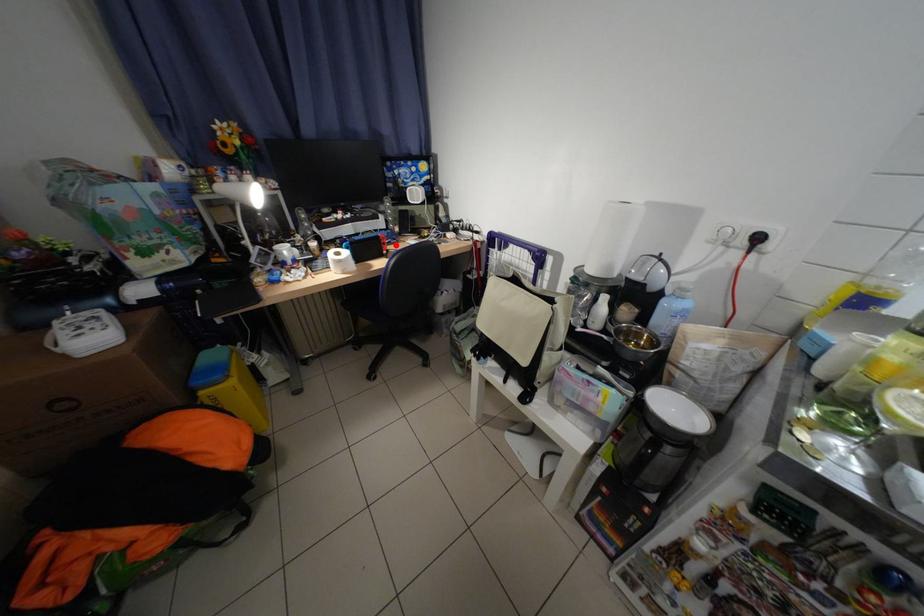
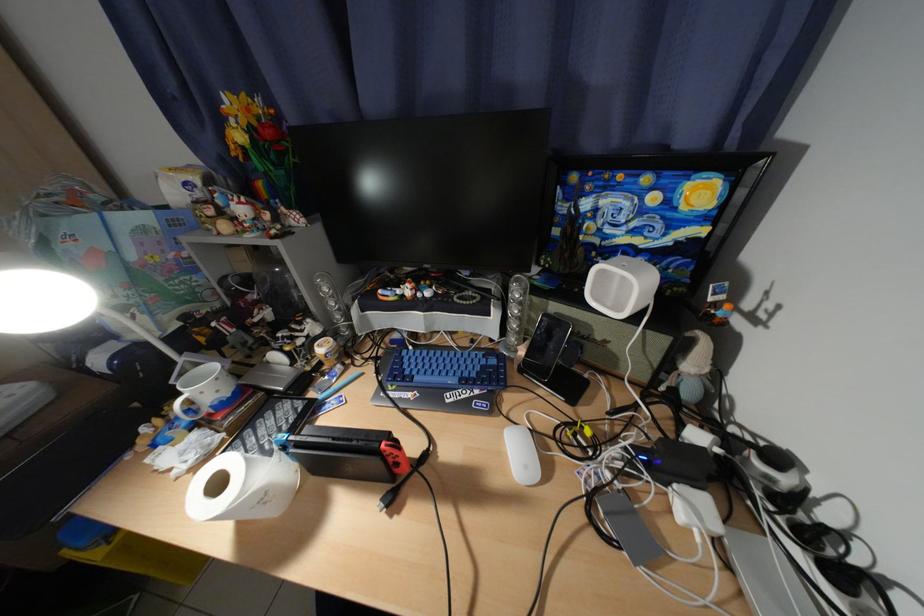
The point at the highlighted location is marked in the first image. Where is the corresponding point in the second image?

(408, 466)